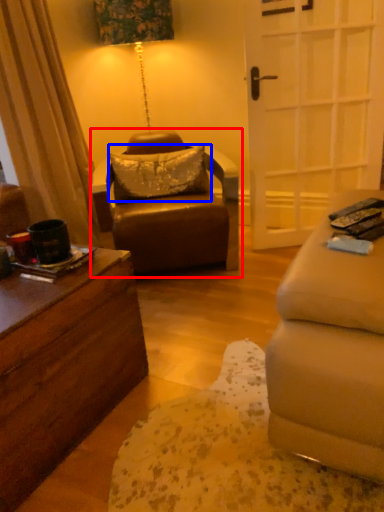
Question: Which object appears closest to the camera in this image, chair (highlighted by a red box) or pillow (highlighted by a blue box)?

Choices:
 (A) chair
 (B) pillow

Answer: (A)